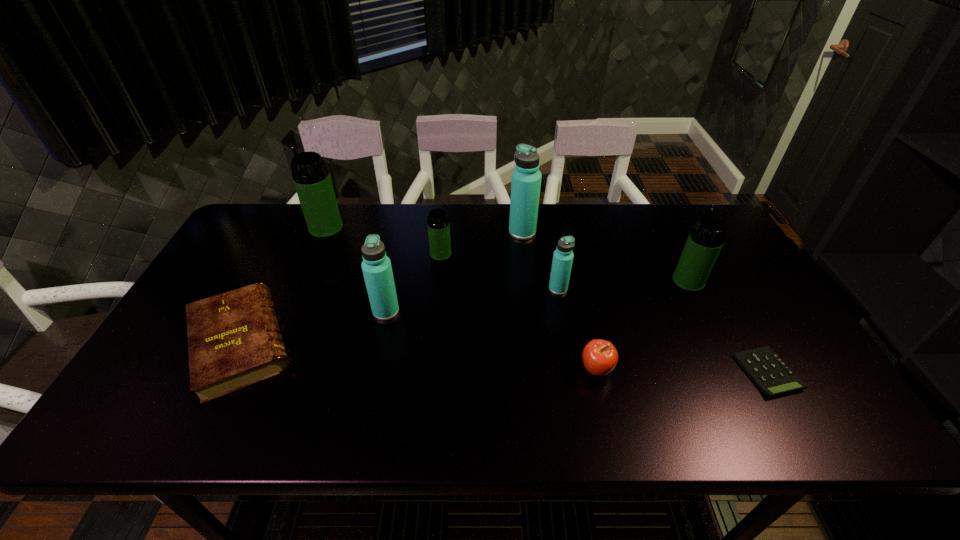
Where is `the second thermos bottle from right to left`? The width and height of the screenshot is (960, 540). the second thermos bottle from right to left is located at coordinates (563, 256).

At what (x,y) coordinates should I click in order to perform the action: click on the rightmost aqua thermos bottle. Please return your answer as a coordinate pair (x, y). This screenshot has width=960, height=540. Looking at the image, I should click on (563, 256).

Identify the location of pink apple. (600, 357).

Where is `apple`? The width and height of the screenshot is (960, 540). apple is located at coordinates (600, 357).

Identify the location of hardback book. (234, 341).

Image resolution: width=960 pixels, height=540 pixels. What are the coordinates of `the shortest object` in the screenshot? It's located at (767, 370).

Find the location of a particular element. Image resolution: width=960 pixels, height=540 pixels. vacant space positioned 0.150m from the spout of the farthest green thermos bottle is located at coordinates (264, 228).

Locate an element on the screen. The width and height of the screenshot is (960, 540). blank space located 0.130m from the spout of the farthest green thermos bottle is located at coordinates (270, 228).

I want to click on free region located from the spout of the farthest green thermos bottle, so click(x=276, y=228).

Where is `free spot located 0.090m on the left of the third thermos bottle from right to left`? Image resolution: width=960 pixels, height=540 pixels. free spot located 0.090m on the left of the third thermos bottle from right to left is located at coordinates (481, 232).